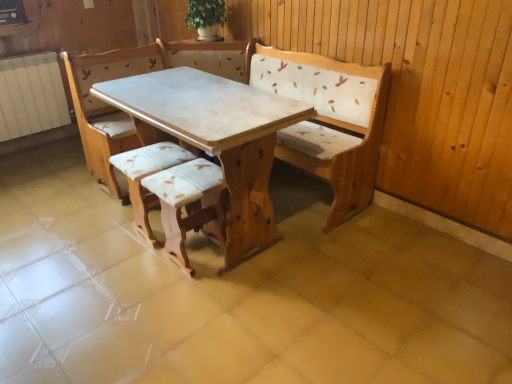
The height and width of the screenshot is (384, 512). Find the location of `free point below white painted metal radiator at left (from a real-world perspective)`. free point below white painted metal radiator at left (from a real-world perspective) is located at coordinates (46, 145).